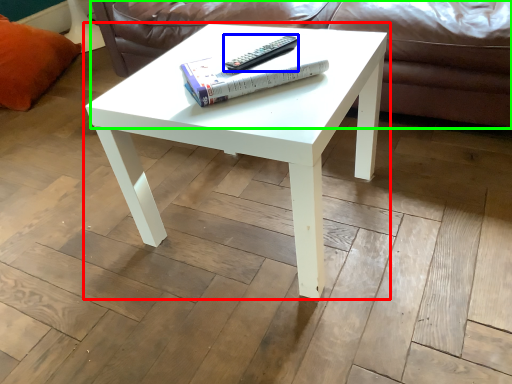
Question: Which is farther away from coffee table (highlighted by a red box)? remote (highlighted by a blue box) or couch (highlighted by a green box)?

Choices:
 (A) remote
 (B) couch

Answer: (B)